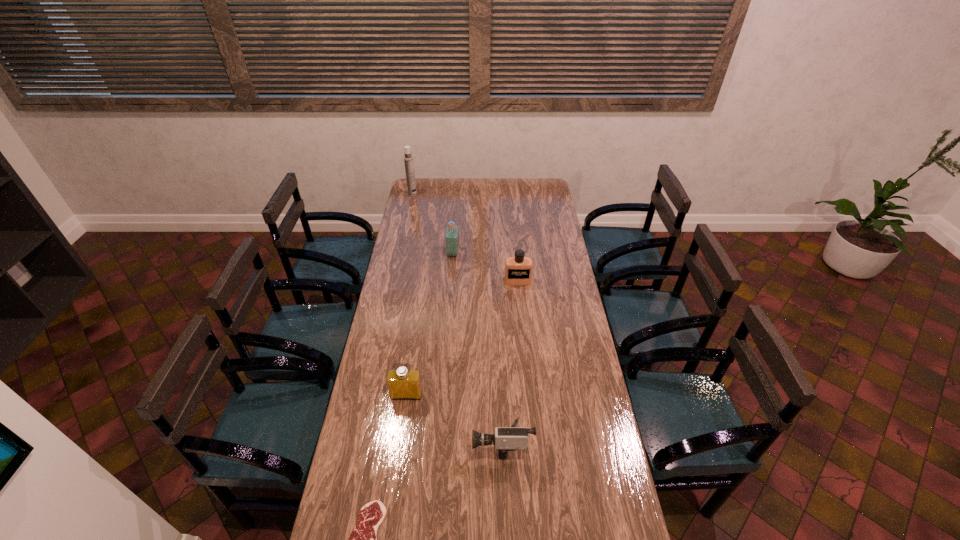
Find the location of a particular element. vacant space in between the camcorder and the leftmost object is located at coordinates (457, 319).

Locate an element on the screen. The width and height of the screenshot is (960, 540). vacant area that lies between the second farthest object and the second nearest perfume is located at coordinates (486, 267).

Point out which object is positioned as the third nearest to the third farthest object. Please provide its 2D coordinates. Your answer should be formatted as a tuple, i.e. [(x, y)], where the tuple contains the x and y coordinates of a point satisfying the conditions above.

[(513, 438)]

This screenshot has height=540, width=960. I want to click on object that is the closest to the second nearest object, so click(x=403, y=383).

Identify the location of the closest perfume to the camcorder. The image size is (960, 540). (403, 383).

Image resolution: width=960 pixels, height=540 pixels. I want to click on the closest perfume to the leftmost object, so click(452, 231).

At what (x,y) coordinates should I click in order to perform the action: click on blank space that satisfies the following two spatial constraints: 1. on the front label of the third farthest object; 2. on the recording direction of the second nearest object. Please return your answer as a coordinate pair (x, y). The height and width of the screenshot is (540, 960). Looking at the image, I should click on (533, 443).